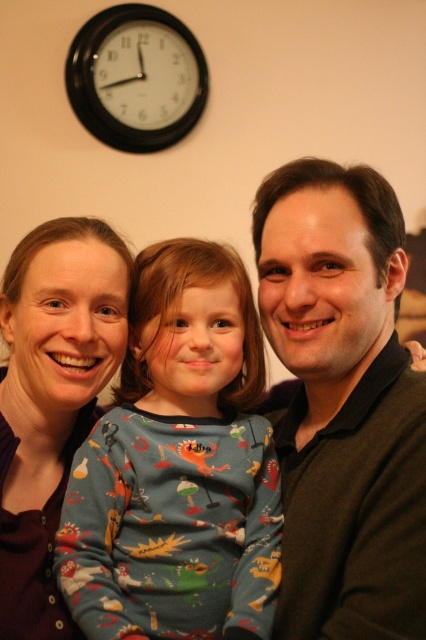
You are a photographer trying to capture a closeup of the printed cotton pajamas at center and dark brown sweater at center. Which one is closer to the camera?

The printed cotton pajamas at center is positioned under the dark brown sweater at center, so the dark brown sweater at center is closer to the camera.

You are a photographer trying to capture a group photo of the family. You notice the printed cotton pajamas at center and the dark brown sweater at center. Which clothing item should you adjust to ensure both are fully visible in the frame?

The printed cotton pajamas at center might be wider than the dark brown sweater at center, so you should adjust the printed cotton pajamas at center to ensure both are fully visible in the frame.

You are a tailor who needs to determine if the dark brown sweater at center can fit into a storage box designed for items smaller than the black plastic clock at upper left. Based on the image, can the sweater fit?

The dark brown sweater at center has a larger size compared to the black plastic clock at upper left, so it cannot fit into the storage box designed for items smaller than the clock.